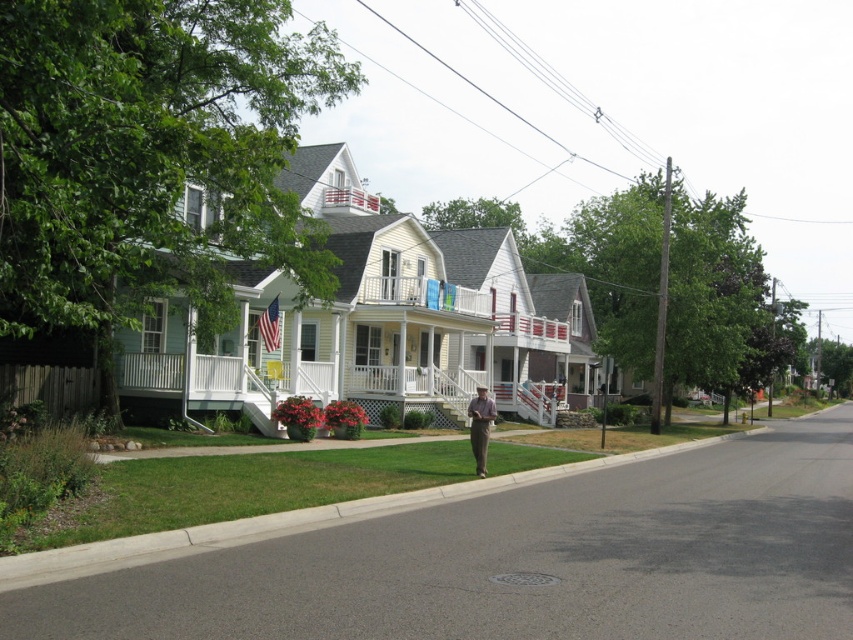
Question: Can you confirm if gray concrete curb at lower center is positioned to the left of light brown pants at center?

Choices:
 (A) yes
 (B) no

Answer: (B)

Question: Which point is farther to the camera?

Choices:
 (A) gray concrete curb at lower center
 (B) light brown pants at center

Answer: (B)

Question: Which point is closer to the camera?

Choices:
 (A) light brown pants at center
 (B) gray concrete curb at lower center

Answer: (B)

Question: Can you confirm if gray concrete curb at lower center is positioned above light brown pants at center?

Choices:
 (A) yes
 (B) no

Answer: (B)

Question: Does gray concrete curb at lower center have a smaller size compared to light brown pants at center?

Choices:
 (A) yes
 (B) no

Answer: (B)